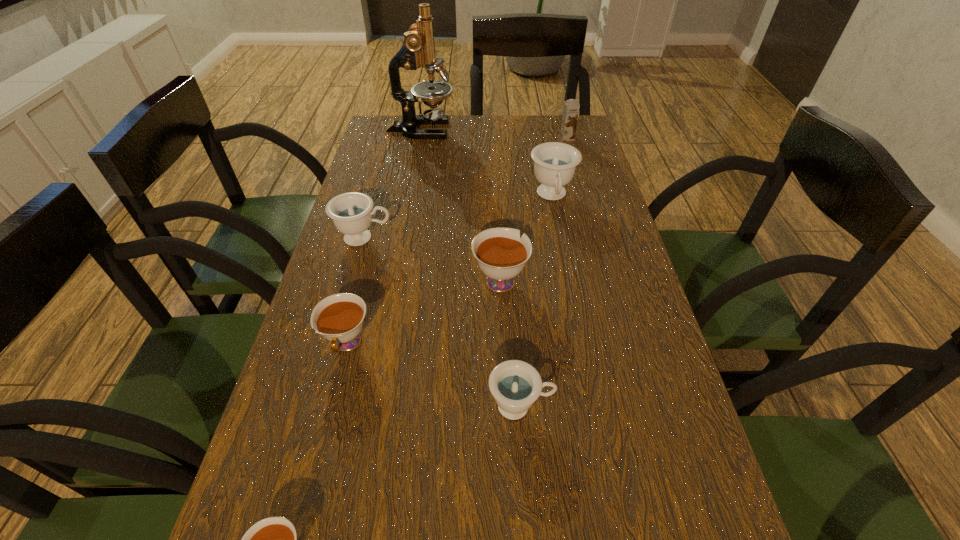
Locate an element on the screen. Image resolution: width=960 pixels, height=540 pixels. microscope is located at coordinates (418, 50).

Locate an element on the screen. The width and height of the screenshot is (960, 540). gray microscope is located at coordinates [x=418, y=50].

Locate an element on the screen. The width and height of the screenshot is (960, 540). chocolate milk is located at coordinates (571, 107).

In order to click on the biggest blue teacup in this screenshot , I will do `click(555, 163)`.

I want to click on the farthest teacup, so click(555, 163).

The height and width of the screenshot is (540, 960). I want to click on the fifth farthest object, so click(x=501, y=254).

At what (x,y) coordinates should I click in order to perform the action: click on the rightmost white teacup. Please return your answer as a coordinate pair (x, y). Image resolution: width=960 pixels, height=540 pixels. Looking at the image, I should click on (501, 254).

Image resolution: width=960 pixels, height=540 pixels. Find the location of `the second farthest teacup`. the second farthest teacup is located at coordinates (351, 213).

The image size is (960, 540). Identify the location of the leftmost blue teacup. [351, 213].

I want to click on the fourth farthest teacup, so click(x=339, y=318).